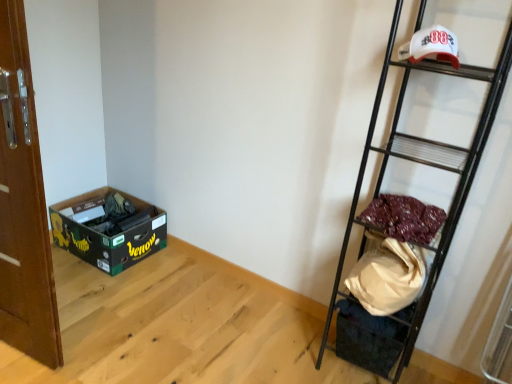
Question: From a real-world perspective, is brown wooden door at left located higher than maroon fabric at right?

Choices:
 (A) no
 (B) yes

Answer: (A)

Question: Is brown wooden door at left in front of maroon fabric at right?

Choices:
 (A) yes
 (B) no

Answer: (A)

Question: Does brown wooden door at left have a smaller size compared to maroon fabric at right?

Choices:
 (A) no
 (B) yes

Answer: (A)

Question: From a real-world perspective, is brown wooden door at left located beneath maroon fabric at right?

Choices:
 (A) yes
 (B) no

Answer: (A)

Question: Does brown wooden door at left touch maroon fabric at right?

Choices:
 (A) no
 (B) yes

Answer: (A)

Question: Is point (37, 187) positioned closer to the camera than point (347, 307)?

Choices:
 (A) farther
 (B) closer

Answer: (B)

Question: Considering the positions of brown wooden door at left and white fabric bag at lower right in the image, is brown wooden door at left taller or shorter than white fabric bag at lower right?

Choices:
 (A) tall
 (B) short

Answer: (A)

Question: Considering the positions of brown wooden door at left and white fabric bag at lower right in the image, is brown wooden door at left bigger or smaller than white fabric bag at lower right?

Choices:
 (A) small
 (B) big

Answer: (B)

Question: From a real-world perspective, relative to white fabric bag at lower right, is brown wooden door at left vertically above or below?

Choices:
 (A) above
 (B) below

Answer: (A)

Question: Considering the positions of maroon fabric at right and white matte baseball cap at upper right in the image, is maroon fabric at right taller or shorter than white matte baseball cap at upper right?

Choices:
 (A) tall
 (B) short

Answer: (B)

Question: Is point (428, 210) positioned closer to the camera than point (455, 38)?

Choices:
 (A) closer
 (B) farther

Answer: (B)

Question: Looking at their shapes, would you say maroon fabric at right is wider or thinner than white matte baseball cap at upper right?

Choices:
 (A) thin
 (B) wide

Answer: (B)

Question: From a real-world perspective, relative to white matte baseball cap at upper right, is maroon fabric at right vertically above or below?

Choices:
 (A) above
 (B) below

Answer: (B)

Question: Based on their sizes in the image, would you say maroon fabric at right is bigger or smaller than black metal ladder at right?

Choices:
 (A) small
 (B) big

Answer: (A)

Question: Does point (386, 221) appear closer or farther from the camera than point (466, 188)?

Choices:
 (A) farther
 (B) closer

Answer: (B)